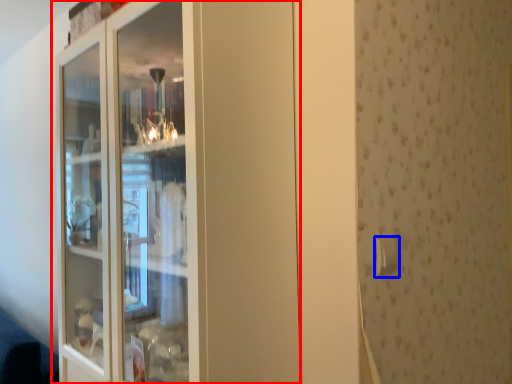
Question: Which object appears closest to the camera in this image, cupboard (highlighted by a red box) or door handle (highlighted by a blue box)?

Choices:
 (A) cupboard
 (B) door handle

Answer: (A)